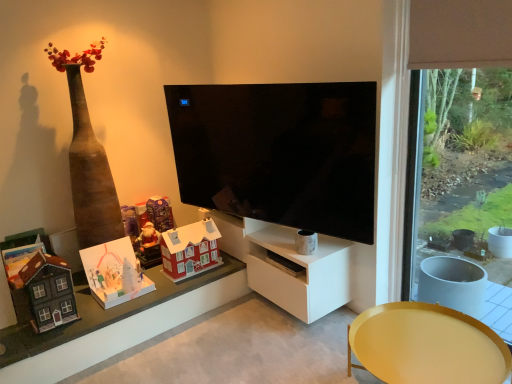
Question: Is point (161, 226) closer or farther from the camera than point (211, 271)?

Choices:
 (A) closer
 (B) farther

Answer: (B)

Question: Is matte purple cardboard at upper left, the 5th toy when ordered from front to back, in front of or behind matte red house at lower left in the image?

Choices:
 (A) behind
 (B) front

Answer: (A)

Question: Which is farther from the matte black tv at center?

Choices:
 (A) matte purple cardboard at upper left, the 5th toy when ordered from front to back
 (B) wooden house at lower left, the fifth toy from the back
 (C) brown wood frame at right
 (D) white paper pop-up at lower left, which is the 4th toy in back-to-front order
 (E) matte plastic santa at center, which is the fourth toy in front-to-back order

Answer: (C)

Question: Which of these objects is positioned farthest from the wooden house at lower left, the 1th toy when ordered from front to back?

Choices:
 (A) matte black tv at center
 (B) matte yellow tray at lower right
 (C) white matte tv cabinet at center
 (D) matte purple cardboard at upper left, acting as the first toy starting from the back
 (E) brown wood frame at right

Answer: (E)